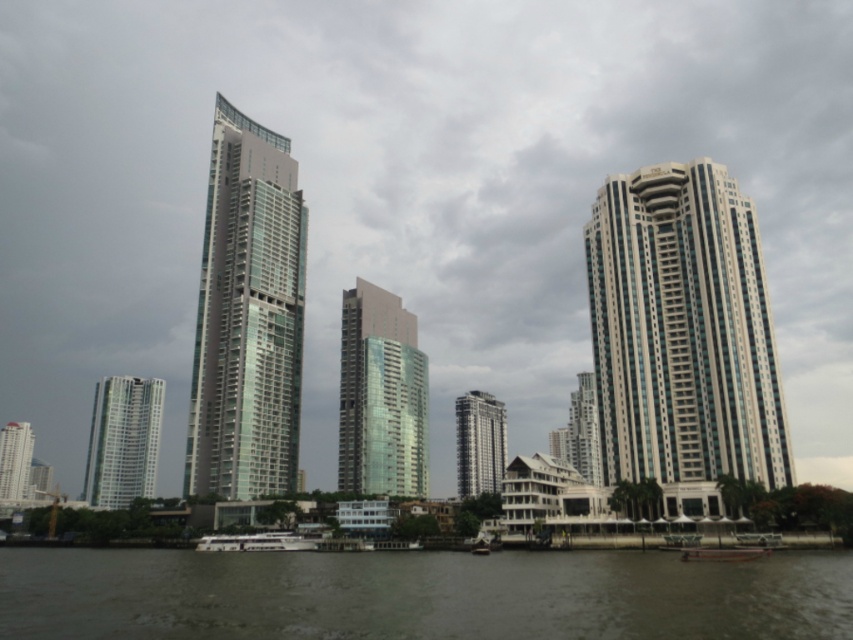
You are standing at point (247,316) in the cityscape. What object is located exactly at your current position?

The glassy metallic skyscraper at center is located exactly at point (247,316).